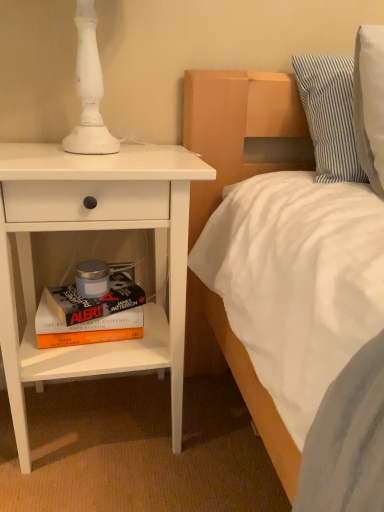
Question: Relative to white matte nightstand at left, is hardcover book at lower left in front or behind?

Choices:
 (A) front
 (B) behind

Answer: (B)

Question: From a real-world perspective, is hardcover book at lower left positioned above or below white matte nightstand at left?

Choices:
 (A) below
 (B) above

Answer: (A)

Question: Which is nearer to the blue striped pillow at upper right?

Choices:
 (A) white matte nightstand at left
 (B) hardcover book at lower left

Answer: (A)

Question: Which object is positioned farthest from the hardcover book at lower left?

Choices:
 (A) blue striped pillow at upper right
 (B) white matte nightstand at left

Answer: (A)